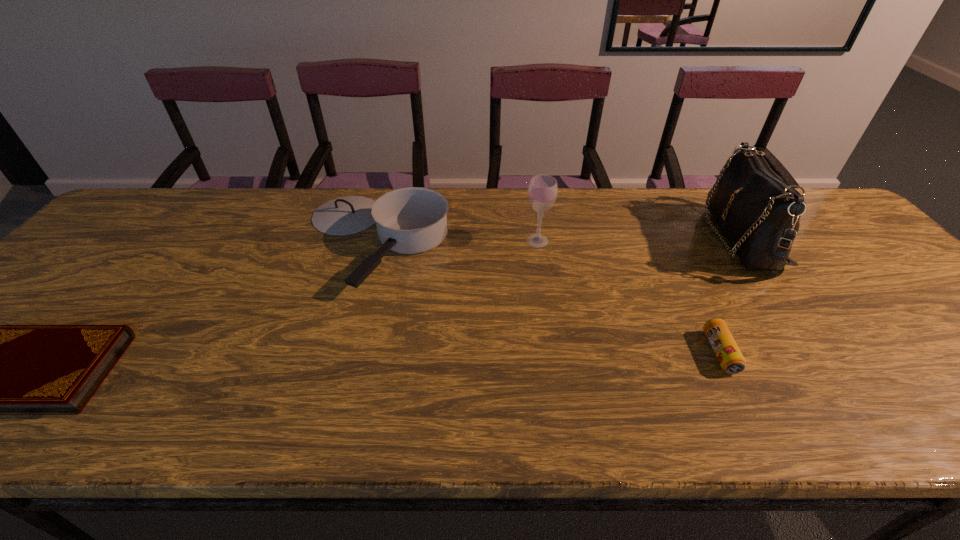
The width and height of the screenshot is (960, 540). I want to click on vacant region located at the front of the handbag with chain and zipper, so click(x=584, y=238).

Find the location of a particular element. This screenshot has height=540, width=960. vacant space located on the right of the third object from right to left is located at coordinates (572, 241).

Locate an element on the screen. This screenshot has width=960, height=540. free point located 0.100m on the right of the saucepan is located at coordinates (486, 241).

Find the location of a particular element. The image size is (960, 540). free location located 0.050m on the back of the second object from right to left is located at coordinates (701, 314).

You are a GUI agent. You are given a task and a screenshot of the screen. Output one action in this format:
    pyautogui.click(x=<x>, y=<y>)
    Task: Click on the handbag that is at the far edge
    The width and height of the screenshot is (960, 540).
    Given the screenshot: What is the action you would take?
    pyautogui.click(x=759, y=213)

Identify the location of wineglass that is positioned at the far edge. (542, 192).

Locate an element on the screen. saucepan present at the far edge is located at coordinates (412, 220).

In the image, there is a desktop. Where is `free space at the far edge`? free space at the far edge is located at coordinates (335, 192).

In the image, there is a desktop. Identify the location of vacant area at the near edge. (864, 430).

In the image, there is a desktop. Identify the location of free space at the right edge. (828, 255).